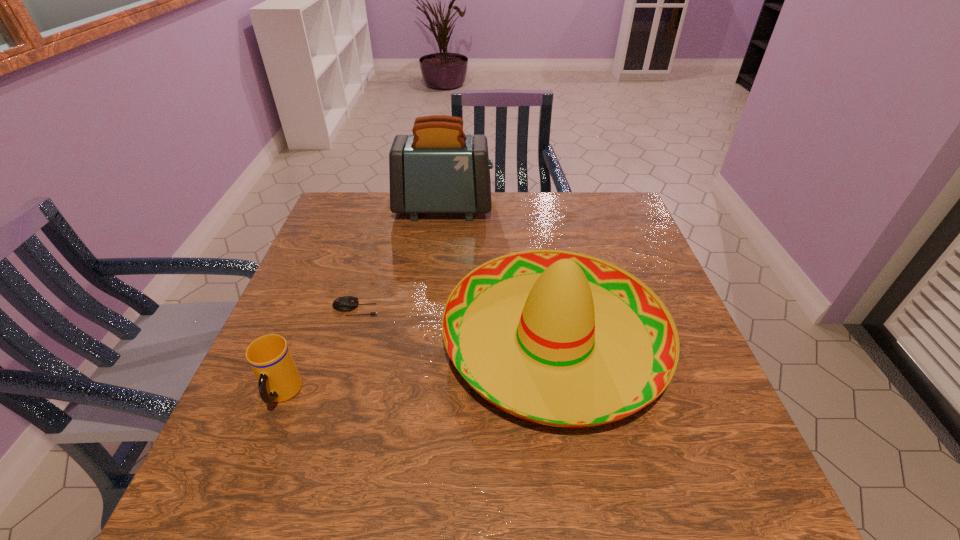
At what (x,y) coordinates should I click in order to perform the action: click on object at the far edge. Please return your answer as a coordinate pair (x, y). The height and width of the screenshot is (540, 960). Looking at the image, I should click on (438, 169).

Image resolution: width=960 pixels, height=540 pixels. Find the location of `cup positioned at the left edge`. cup positioned at the left edge is located at coordinates (269, 356).

Where is `mouse that is at the left edge`? mouse that is at the left edge is located at coordinates (345, 303).

Find the location of a particular element. object at the right edge is located at coordinates (559, 338).

Image resolution: width=960 pixels, height=540 pixels. In the image, there is a desktop. Find the location of `vacant space at the far edge`. vacant space at the far edge is located at coordinates (541, 208).

This screenshot has height=540, width=960. Find the location of `free space at the near edge`. free space at the near edge is located at coordinates (392, 474).

Identify the location of free location at the left edge of the desktop. (304, 315).

This screenshot has width=960, height=540. In the image, there is a desktop. Find the location of `vacant space at the right edge`. vacant space at the right edge is located at coordinates (592, 246).

Find the location of a particular element. The width and height of the screenshot is (960, 540). vacant position at the far left corner of the desktop is located at coordinates click(x=335, y=224).

This screenshot has width=960, height=540. In the image, there is a desktop. In order to click on vacant space at the near right corner in this screenshot , I will do `click(736, 474)`.